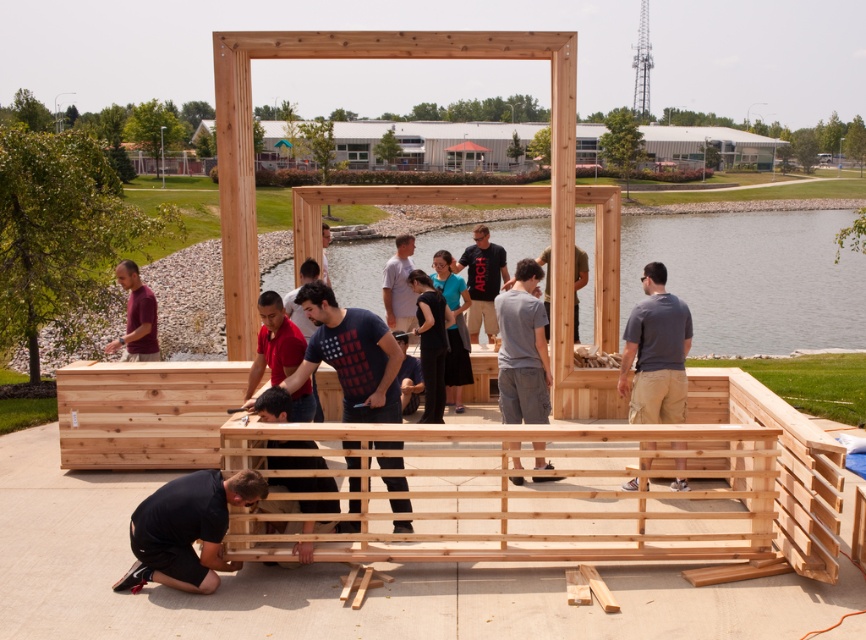
You are a visitor observing the construction site. You notice two workers, the black matte construction worker at lower left and the maroon shirt at left. Which worker takes up less visual space in the image?

The black matte construction worker at lower left occupies less space than the maroon shirt at left, so the black matte construction worker at lower left takes up less visual space.

You are standing at the center of the construction site and see two points marked on the wooden structure. The first point is at coordinates point (186, 531) and the second point is at point (136, 275). Which of these two points is closer to you?

Point (186, 531) is in front of point (136, 275), so it is closer to you.

You are a new worker arriving at the construction site. You see the black matte construction worker at lower left and the maroon shirt at left. Which worker is closer to you?

The black matte construction worker at lower left is closer to you since it is only 3.43 meters away from the maroon shirt at left, but without knowing your exact position, we can only compare their distance relative to each other. However, since the question asks which is closer to you, and the description states their distance from each other, perhaps the answer should clarify that based on their positions, if you are positioned such that both are visible, the one at lower left might be closer depending.